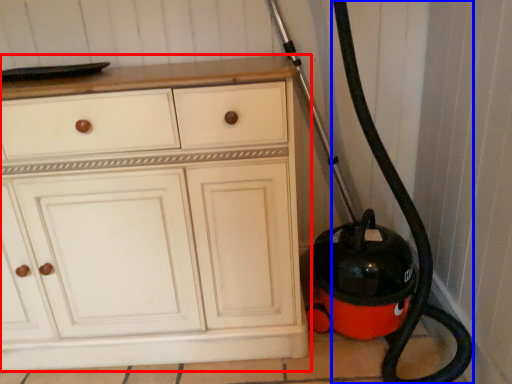
Question: Which of the following is the closest to the observer, chest of drawers (highlighted by a red box) or garden hose (highlighted by a blue box)?

Choices:
 (A) chest of drawers
 (B) garden hose

Answer: (B)